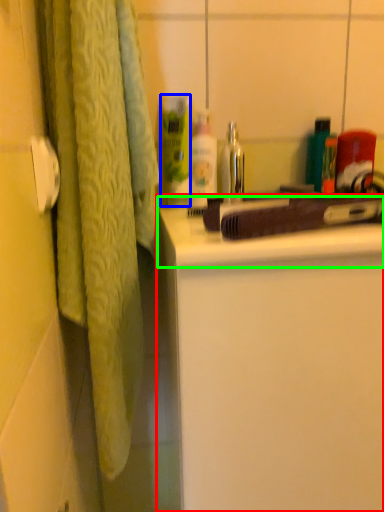
Question: Estimate the real-world distances between objects in this image. Which object is farther from bathroom cabinet (highlighted by a red box), cleaning product (highlighted by a blue box) or counter top (highlighted by a green box)?

Choices:
 (A) cleaning product
 (B) counter top

Answer: (A)